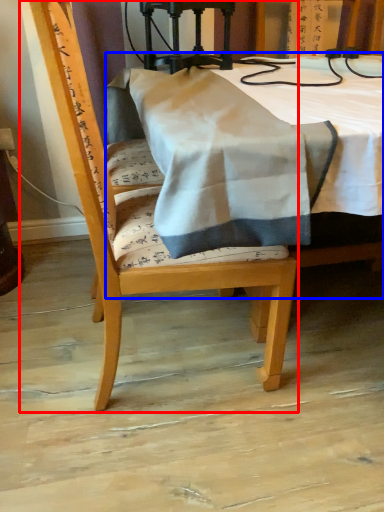
Question: Which object is further to the camera taking this photo, chair (highlighted by a red box) or table (highlighted by a blue box)?

Choices:
 (A) chair
 (B) table

Answer: (A)